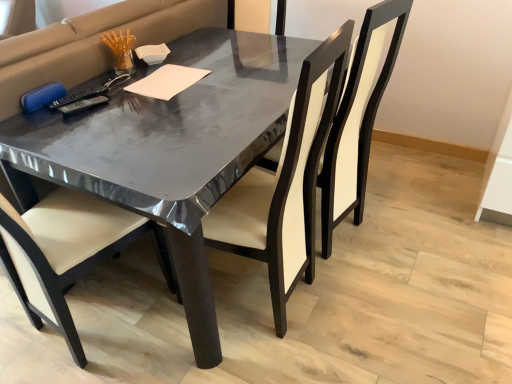
This screenshot has width=512, height=384. What are the coordinates of `free space in front of white paper at center` in the screenshot? It's located at (162, 110).